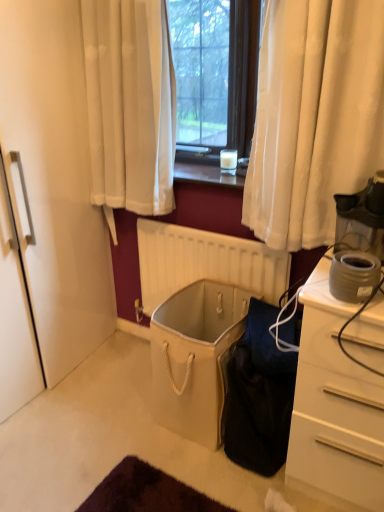
Question: Does point (218, 402) appear closer or farther from the camera than point (226, 150)?

Choices:
 (A) closer
 (B) farther

Answer: (A)

Question: From a real-world perspective, is beige fabric laundry basket at center above or below translucent glass coffee cup at center?

Choices:
 (A) below
 (B) above

Answer: (A)

Question: Which object is positioned closest to the matte gray coffee maker at right, which is counted as the 1th appliance, starting from the bottom?

Choices:
 (A) beige matte radiator at center
 (B) translucent glass coffee cup at center
 (C) black fabric bag at lower center
 (D) beige fabric laundry basket at center
 (E) transparent plastic coffee maker at right, positioned as the 1th appliance in top-to-bottom order

Answer: (E)

Question: Which is nearer to the black fabric bag at lower center?

Choices:
 (A) transparent plastic coffee maker at right, positioned as the 1th appliance in top-to-bottom order
 (B) beige fabric laundry basket at center
 (C) beige matte radiator at center
 (D) translucent glass coffee cup at center
 (E) matte gray coffee maker at right, which is the second appliance in top-to-bottom order

Answer: (B)